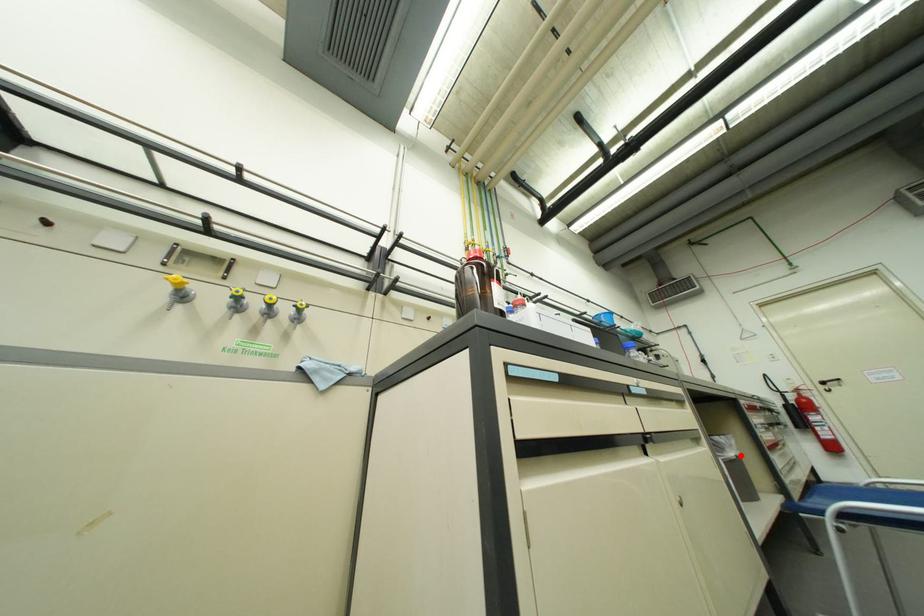
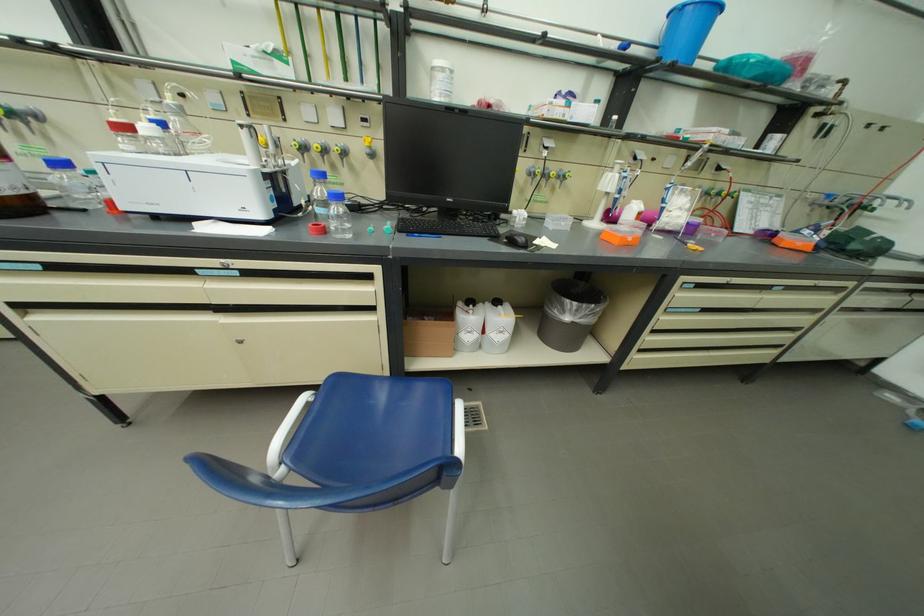
The point at the highlighted location is marked in the first image. Where is the corresponding point in the second image?

(577, 320)